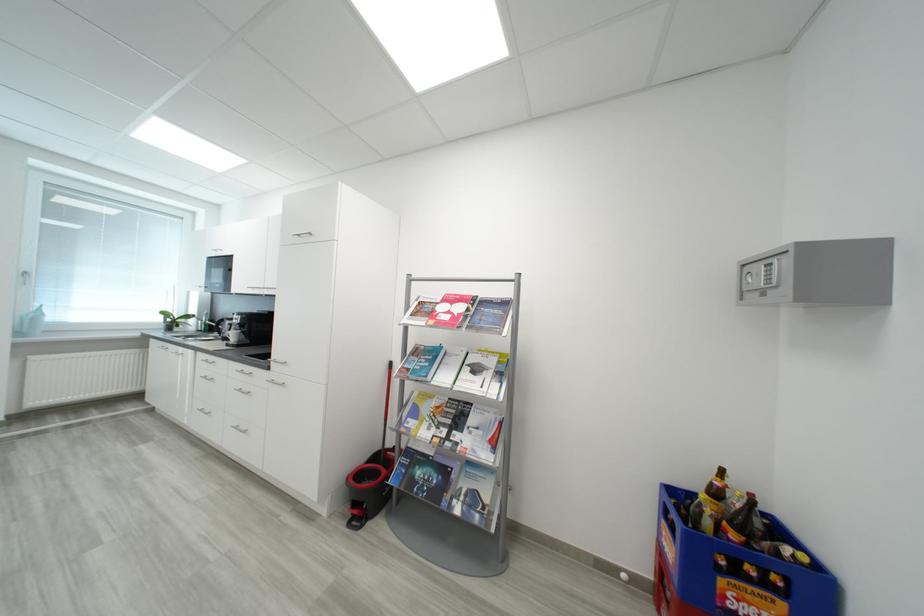
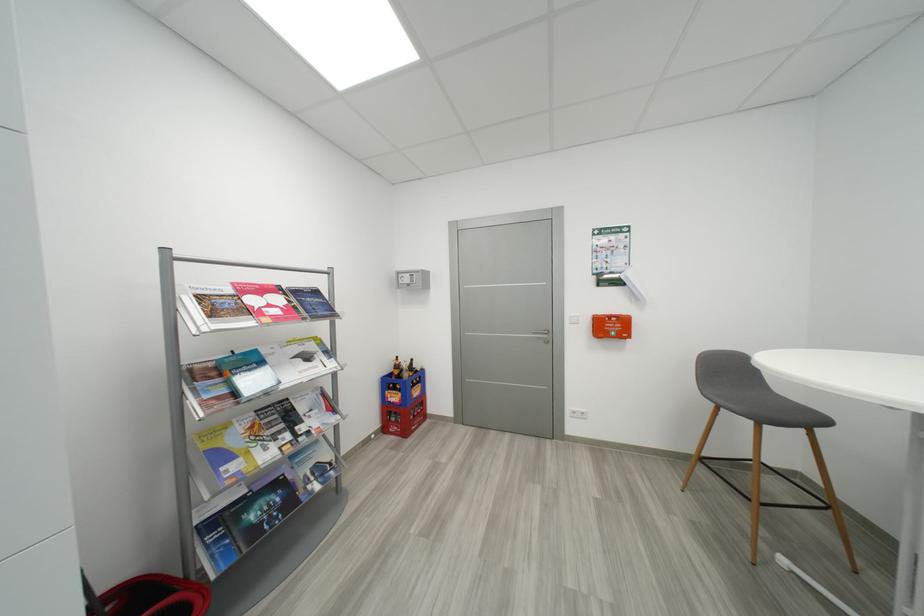
The point at (x=452, y=434) is marked in the first image. Where is the corresponding point in the second image?

(294, 438)